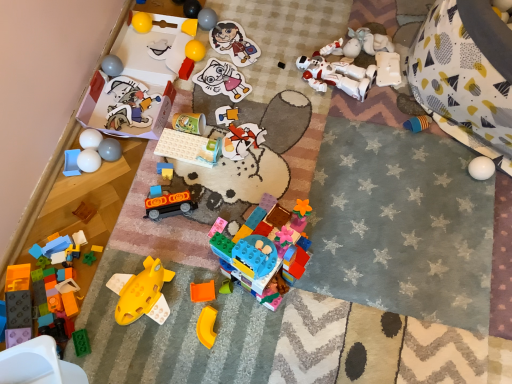
Locate an element on the screen. free spot behind smooth yellow ball at upper center, which is the 15th toy from left to right is located at coordinates (213, 10).